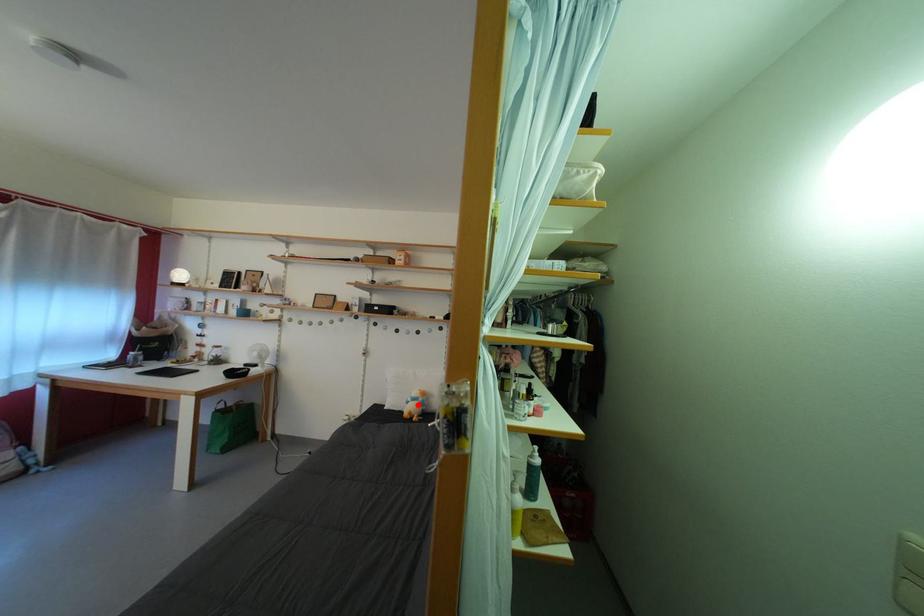
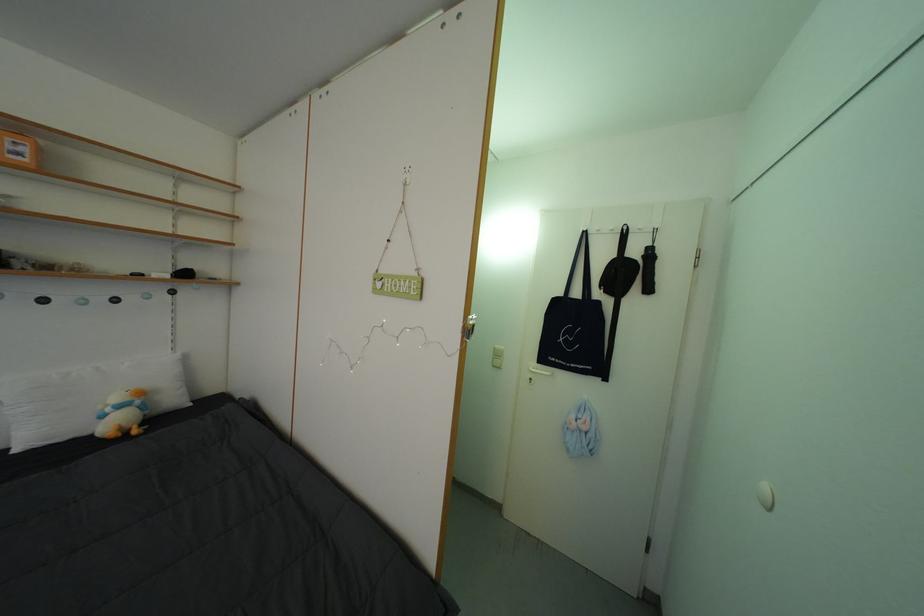
In the second image, find the point that corresponds to the highlighted location in the first image.

(117, 415)